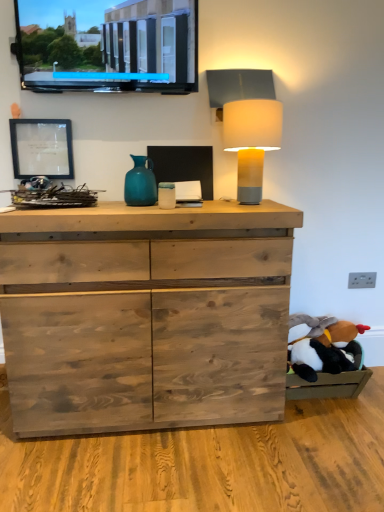
Question: Do you think natural wood chest of drawers at center is within teal glass vase at center, or outside of it?

Choices:
 (A) outside
 (B) inside

Answer: (A)

Question: Is natural wood chest of drawers at center bigger or smaller than teal glass vase at center?

Choices:
 (A) big
 (B) small

Answer: (A)

Question: Which of these objects is positioned closest to the teal glass vase at center?

Choices:
 (A) black plush toy at lower right
 (B) matte black screen at upper left
 (C) matte glass picture frame at upper left
 (D) natural wood chest of drawers at center
 (E) matte yellow lampshade at upper right

Answer: (C)

Question: Considering the real-world distances, which object is closest to the black plush toy at lower right?

Choices:
 (A) matte glass picture frame at upper left
 (B) matte yellow lampshade at upper right
 (C) teal glass vase at center
 (D) natural wood chest of drawers at center
 (E) matte black screen at upper left

Answer: (D)